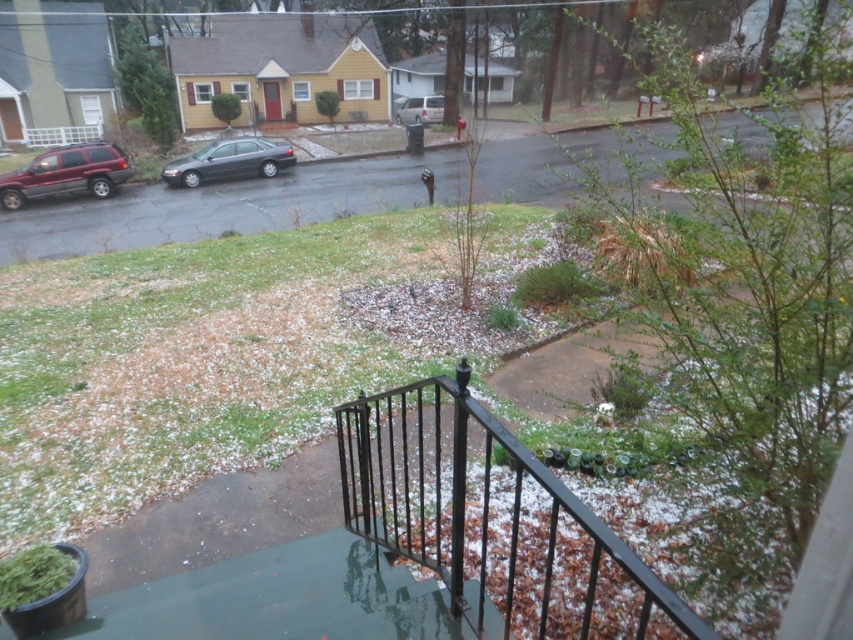
Is black wrought iron railing at lower center shorter than shiny dark gray sedan at center-left?

Incorrect, black wrought iron railing at lower center's height does not fall short of shiny dark gray sedan at center-left's.

Which of these two, black wrought iron railing at lower center or shiny dark gray sedan at center-left, stands taller?

Standing taller between the two is black wrought iron railing at lower center.

This screenshot has height=640, width=853. Identify the location of black wrought iron railing at lower center. coord(492,520).

Where is `metallic maroon suv at left`? Image resolution: width=853 pixels, height=640 pixels. metallic maroon suv at left is located at coordinates (67, 173).

Is black wrought iron railing at lower center smaller than silver metallic van at center?

No, black wrought iron railing at lower center is not smaller than silver metallic van at center.

The height and width of the screenshot is (640, 853). What do you see at coordinates (492, 520) in the screenshot?
I see `black wrought iron railing at lower center` at bounding box center [492, 520].

This screenshot has height=640, width=853. I want to click on black wrought iron railing at lower center, so click(x=492, y=520).